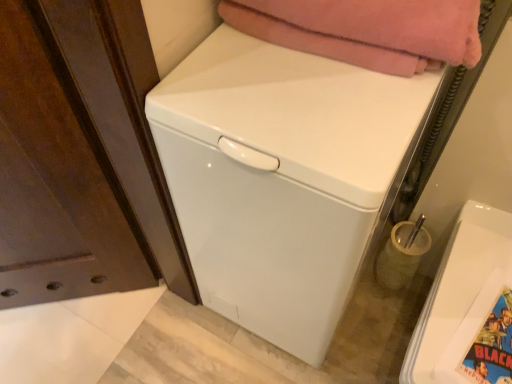
Identify the location of free area behind colorful glossy comic book at lower right. (476, 274).